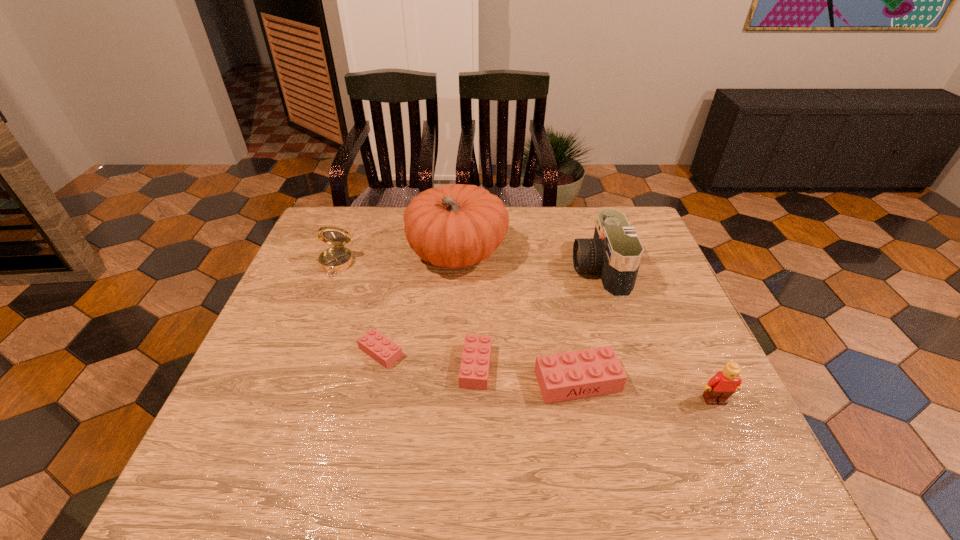
Identify the location of vacant space at the near right corner of the desktop. The width and height of the screenshot is (960, 540). (730, 430).

Where is `unoccupied area between the second tallest Lego and the third Lego from right to left`? Image resolution: width=960 pixels, height=540 pixels. unoccupied area between the second tallest Lego and the third Lego from right to left is located at coordinates (527, 374).

This screenshot has height=540, width=960. Identify the location of free area in between the leftmost object and the shortest object. (358, 308).

In order to click on vacant area that lies between the second tallest object and the leftmost Lego in this screenshot , I will do `click(490, 310)`.

At what (x,y) coordinates should I click in order to perform the action: click on vacant area that lies between the shortest Lego and the pumpkin. Please return your answer as a coordinate pair (x, y). The image size is (960, 540). Looking at the image, I should click on (419, 302).

You are a GUI agent. You are given a task and a screenshot of the screen. Output one action in this format:
    pyautogui.click(x=<x>, y=<y>)
    Task: Click on the vacant area that lies between the second Lego from left to right and the fifth tallest object
    This screenshot has width=960, height=540.
    Given the screenshot: What is the action you would take?
    pyautogui.click(x=527, y=374)

This screenshot has width=960, height=540. In order to click on free spot between the compass and the tallest Lego in this screenshot , I will do `click(525, 332)`.

Where is `blank region between the fifth tallest object and the third tallest Lego`? blank region between the fifth tallest object and the third tallest Lego is located at coordinates (527, 374).

This screenshot has height=540, width=960. What are the coordinates of `object that stands as the sixth closest to the tallest Lego` in the screenshot? It's located at (338, 258).

You are a GUI agent. You are given a task and a screenshot of the screen. Output one action in this format:
    pyautogui.click(x=<x>, y=<y>)
    Task: Click on the object that is the nearest to the third tallest Lego
    
    Given the screenshot: What is the action you would take?
    pyautogui.click(x=572, y=375)